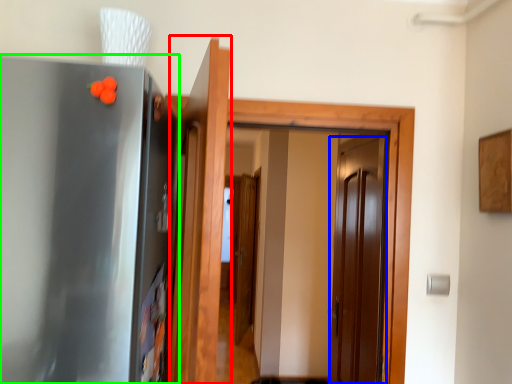
Question: Which is farther away from door (highlighted by a red box)? door (highlighted by a blue box) or appliance (highlighted by a green box)?

Choices:
 (A) door
 (B) appliance

Answer: (A)